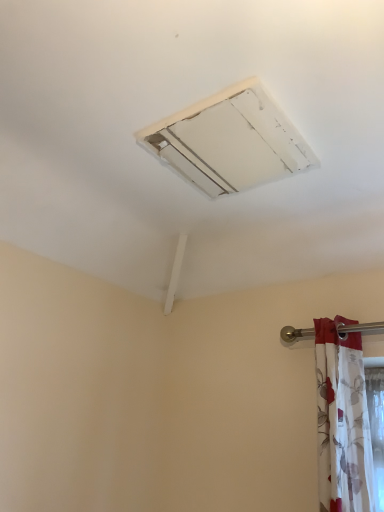
Question: From a real-world perspective, does white matte air conditioning at upper center sit lower than white floral fabric at right?

Choices:
 (A) no
 (B) yes

Answer: (A)

Question: Does white matte air conditioning at upper center have a lesser height compared to white floral fabric at right?

Choices:
 (A) yes
 (B) no

Answer: (A)

Question: Does white matte air conditioning at upper center appear on the left side of white floral fabric at right?

Choices:
 (A) no
 (B) yes

Answer: (B)

Question: Is white matte air conditioning at upper center behind white floral fabric at right?

Choices:
 (A) no
 (B) yes

Answer: (A)

Question: Does white matte air conditioning at upper center appear on the right side of white floral fabric at right?

Choices:
 (A) yes
 (B) no

Answer: (B)

Question: Is the position of white matte air conditioning at upper center less distant than that of white floral fabric at right?

Choices:
 (A) yes
 (B) no

Answer: (A)

Question: Is white floral fabric at right smaller than white matte air conditioning at upper center?

Choices:
 (A) no
 (B) yes

Answer: (A)

Question: Is white floral fabric at right positioned in front of white matte air conditioning at upper center?

Choices:
 (A) no
 (B) yes

Answer: (A)

Question: Does white floral fabric at right have a lesser width compared to white matte air conditioning at upper center?

Choices:
 (A) yes
 (B) no

Answer: (A)

Question: From the image's perspective, would you say white floral fabric at right is positioned over white matte air conditioning at upper center?

Choices:
 (A) no
 (B) yes

Answer: (A)

Question: Is white floral fabric at right not inside white matte air conditioning at upper center?

Choices:
 (A) yes
 (B) no

Answer: (A)

Question: Is white matte air conditioning at upper center a part of white floral fabric at right?

Choices:
 (A) no
 (B) yes

Answer: (A)

Question: From a real-world perspective, is white floral fabric at right physically located above or below white matte air conditioning at upper center?

Choices:
 (A) below
 (B) above

Answer: (A)